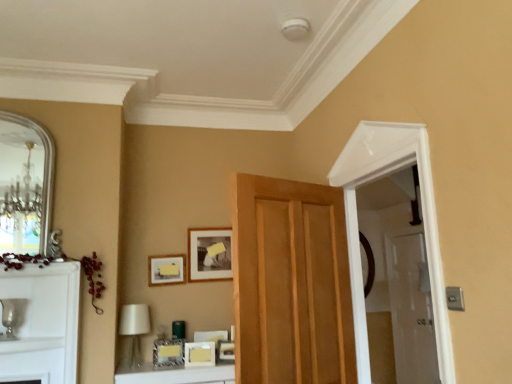
Where is `white fabric lampshade at lower left`? white fabric lampshade at lower left is located at coordinates (135, 327).

This screenshot has height=384, width=512. In order to click on matte black picture frame at upper center, acting as the 5th picture frame starting from the front in this screenshot , I will do `click(209, 254)`.

Identify the location of white fabric lampshade at lower left. This screenshot has height=384, width=512. (135, 327).

Looking at this image, from the image's perspective, is white fabric lampshade at lower left on top of clear glass door at right?

Correct, white fabric lampshade at lower left appears higher than clear glass door at right in the image.

Between point (129, 321) and point (398, 278), which one is positioned in front?

The point (129, 321) is more forward.

Considering the relative sizes of white fabric lampshade at lower left and clear glass door at right in the image provided, is white fabric lampshade at lower left bigger than clear glass door at right?

Incorrect, white fabric lampshade at lower left is not larger than clear glass door at right.

From a real-world perspective, is white fabric lampshade at lower left located beneath clear glass door at right?

No, from a real-world perspective, white fabric lampshade at lower left is not below clear glass door at right.

Does matte black picture frame at upper center, acting as the 5th picture frame starting from the front, turn towards silver metallic mirror at left?

No, matte black picture frame at upper center, acting as the 5th picture frame starting from the front, is not turned towards silver metallic mirror at left.

Which object is closer to the camera taking this photo, matte black picture frame at upper center, positioned as the 1th picture frame in back-to-front order, or silver metallic mirror at left?

silver metallic mirror at left is closer to the camera.

From the image's perspective, is matte black picture frame at upper center, acting as the 5th picture frame starting from the front, above or below silver metallic mirror at left?

Clearly, from the image's perspective, matte black picture frame at upper center, acting as the 5th picture frame starting from the front, is below silver metallic mirror at left.

From the picture: Can you confirm if matte black picture frame at upper center, acting as the 5th picture frame starting from the front, is wider than silver metallic mirror at left?

No.

Is matte gold picture frame at center, the third picture frame when ordered from back to front, at the back of clear glass door at right?

No, clear glass door at right's orientation is not away from matte gold picture frame at center, the third picture frame when ordered from back to front.

You are a GUI agent. You are given a task and a screenshot of the screen. Output one action in this format:
    pyautogui.click(x=<x>, y=<y>)
    Task: Click on the glass door located below the matte gold picture frame at center, the third picture frame when ordered from back to front (from the image's perspective)
    This screenshot has width=512, height=384.
    Given the screenshot: What is the action you would take?
    pyautogui.click(x=411, y=308)

From a real-world perspective, between clear glass door at right and matte gold picture frame at center, the third picture frame when ordered from back to front, who is vertically lower?

From a 3D spatial view, clear glass door at right is below.

Considering the positions of objects clear glass door at right and matte gold picture frame at center, which appears as the 3th picture frame when viewed from the front, in the image provided, who is more to the left, clear glass door at right or matte gold picture frame at center, which appears as the 3th picture frame when viewed from the front,?

matte gold picture frame at center, which appears as the 3th picture frame when viewed from the front.

Looking at this image, how different are the orientations of matte gold picture frame at center, the 4th picture frame positioned from the back, and wooden door at center in degrees?

There is a 154-degree angle between the facing directions of matte gold picture frame at center, the 4th picture frame positioned from the back, and wooden door at center.

Based on their positions, is matte gold picture frame at center, the 4th picture frame positioned from the back, located to the left or right of wooden door at center?

In the image, matte gold picture frame at center, the 4th picture frame positioned from the back, appears on the left side of wooden door at center.

Is matte gold picture frame at center, the 4th picture frame positioned from the back, oriented towards wooden door at center?

No, matte gold picture frame at center, the 4th picture frame positioned from the back, is not aimed at wooden door at center.

Looking at this image, can you confirm if matte gold picture frame at center, the 2th picture frame from the front, is smaller than wooden door at center?

Indeed, matte gold picture frame at center, the 2th picture frame from the front, has a smaller size compared to wooden door at center.

How much distance is there between matte gold picture frame at upper center, which is the 4th picture frame from front to back, and white fabric lampshade at lower left?

12.61 inches.

From a real-world perspective, which object stands above the other?

matte gold picture frame at upper center, which is the 4th picture frame from front to back, from a real-world perspective.

Considering the positions of objects matte gold picture frame at upper center, which is the 4th picture frame from front to back, and white fabric lampshade at lower left in the image provided, who is more to the right, matte gold picture frame at upper center, which is the 4th picture frame from front to back, or white fabric lampshade at lower left?

matte gold picture frame at upper center, which is the 4th picture frame from front to back, is more to the right.

From the picture: Measure the distance from white fabric lampshade at lower left to matte gold picture frame at center, the first picture frame when ordered from front to back.

white fabric lampshade at lower left and matte gold picture frame at center, the first picture frame when ordered from front to back, are 15.10 inches apart from each other.

Between white fabric lampshade at lower left and matte gold picture frame at center, positioned as the fifth picture frame in back-to-front order, which one has more height?

white fabric lampshade at lower left is taller.

Is white fabric lampshade at lower left not near matte gold picture frame at center, positioned as the fifth picture frame in back-to-front order?

No, there isn't a large distance between white fabric lampshade at lower left and matte gold picture frame at center, positioned as the fifth picture frame in back-to-front order.

Is the depth of white fabric lampshade at lower left less than that of matte gold picture frame at center, the first picture frame when ordered from front to back?

Yes, white fabric lampshade at lower left is in front of matte gold picture frame at center, the first picture frame when ordered from front to back.

Can you tell me how much clear glass door at right and matte black picture frame at upper center, positioned as the 1th picture frame in back-to-front order, differ in facing direction?

clear glass door at right and matte black picture frame at upper center, positioned as the 1th picture frame in back-to-front order, are facing 89.1 degrees away from each other.

Is clear glass door at right in front of or behind matte black picture frame at upper center, positioned as the 1th picture frame in back-to-front order, in the image?

Visually, clear glass door at right is located behind matte black picture frame at upper center, positioned as the 1th picture frame in back-to-front order.

Is clear glass door at right to the left of matte black picture frame at upper center, positioned as the 1th picture frame in back-to-front order, from the viewer's perspective?

In fact, clear glass door at right is to the right of matte black picture frame at upper center, positioned as the 1th picture frame in back-to-front order.

Can you see clear glass door at right touching matte black picture frame at upper center, acting as the 5th picture frame starting from the front?

clear glass door at right and matte black picture frame at upper center, acting as the 5th picture frame starting from the front, are clearly separated.

The image size is (512, 384). Find the location of `glass door lying behind the white fabric lampshade at lower left`. glass door lying behind the white fabric lampshade at lower left is located at coordinates (411, 308).

This screenshot has width=512, height=384. There is a silver metallic mirror at left. Find the location of `the 1st picture frame below it (from the image's perspective)`. the 1st picture frame below it (from the image's perspective) is located at coordinates (209, 254).

Estimate the real-world distances between objects in this image. Which object is further from matte gold picture frame at center, positioned as the fifth picture frame in back-to-front order, matte black picture frame at upper center, positioned as the 1th picture frame in back-to-front order, or matte gold picture frame at center, the 4th picture frame positioned from the back?

Based on the image, matte black picture frame at upper center, positioned as the 1th picture frame in back-to-front order, appears to be further to matte gold picture frame at center, positioned as the fifth picture frame in back-to-front order.

Estimate the real-world distances between objects in this image. Which object is further from matte gold picture frame at upper center, which is the 4th picture frame from front to back, matte black picture frame at upper center, acting as the 5th picture frame starting from the front, or white fabric lampshade at lower left?

Among the two, white fabric lampshade at lower left is located further to matte gold picture frame at upper center, which is the 4th picture frame from front to back.

Estimate the real-world distances between objects in this image. Which object is closer to matte gold picture frame at center, the 4th picture frame positioned from the back, clear glass door at right or matte gold picture frame at upper center, which is the 4th picture frame from front to back?

Based on the image, matte gold picture frame at upper center, which is the 4th picture frame from front to back, appears to be nearer to matte gold picture frame at center, the 4th picture frame positioned from the back.

Based on their spatial positions, is wooden door at center or matte black picture frame at upper center, positioned as the 1th picture frame in back-to-front order, further from matte gold picture frame at upper center, which is the 4th picture frame from front to back?

wooden door at center.

From the image, which object appears to be farther from silver metallic mirror at left, wooden door at center or white fabric lampshade at lower left?

Based on the image, wooden door at center appears to be further to silver metallic mirror at left.

From the picture: Which object lies further to the anchor point matte gold picture frame at center, the third picture frame when ordered from back to front, matte black picture frame at upper center, positioned as the 1th picture frame in back-to-front order, or matte gold picture frame at center, the first picture frame when ordered from front to back?

matte black picture frame at upper center, positioned as the 1th picture frame in back-to-front order.

Estimate the real-world distances between objects in this image. Which object is closer to matte gold picture frame at center, which appears as the 3th picture frame when viewed from the front, matte gold picture frame at center, the 4th picture frame positioned from the back, or matte black picture frame at upper center, acting as the 5th picture frame starting from the front?

matte gold picture frame at center, the 4th picture frame positioned from the back, is closer to matte gold picture frame at center, which appears as the 3th picture frame when viewed from the front.

Looking at this image, from the image, which object appears to be nearer to white fabric lampshade at lower left, matte gold picture frame at upper center, which is the 4th picture frame from front to back, or clear glass door at right?

matte gold picture frame at upper center, which is the 4th picture frame from front to back, is closer to white fabric lampshade at lower left.

In order to click on door between white fabric lampshade at lower left and clear glass door at right from left to right in this screenshot , I will do `click(291, 283)`.

Locate an element on the screen. The height and width of the screenshot is (384, 512). picture frame between matte black picture frame at upper center, positioned as the 1th picture frame in back-to-front order, and matte gold picture frame at center, positioned as the fifth picture frame in back-to-front order, in the vertical direction is located at coordinates (166, 269).

Find the location of a particular element. This screenshot has width=512, height=384. lamp between matte gold picture frame at upper center, which is the 4th picture frame from front to back, and matte gold picture frame at center, which appears as the 3th picture frame when viewed from the front, vertically is located at coordinates (135, 327).

At what (x,y) coordinates should I click in order to perform the action: click on lamp that lies between matte black picture frame at upper center, positioned as the 1th picture frame in back-to-front order, and matte gold picture frame at center, positioned as the fifth picture frame in back-to-front order, from top to bottom. Please return your answer as a coordinate pair (x, y). Image resolution: width=512 pixels, height=384 pixels. Looking at the image, I should click on (135, 327).